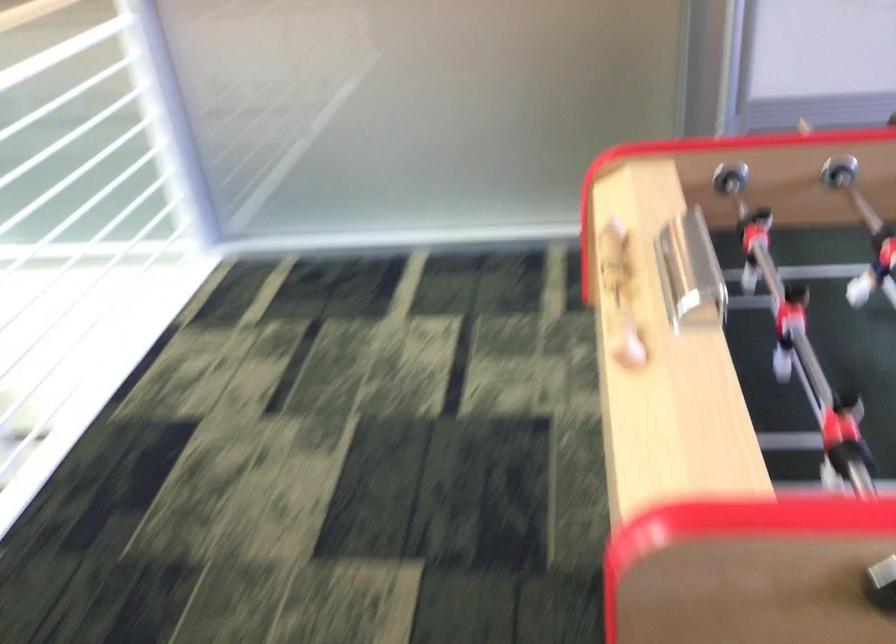
Locate an element on the screen. The height and width of the screenshot is (644, 896). black rod handle is located at coordinates (729, 178).